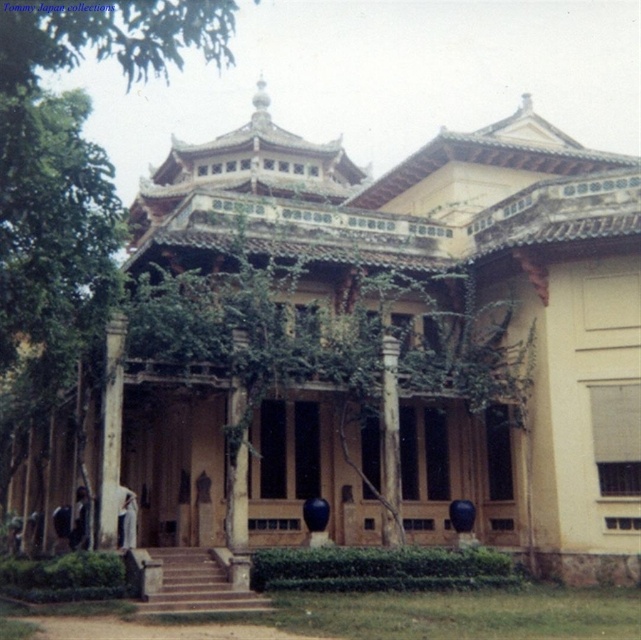
You are standing at the entrance of the traditional building and notice a green leafy tree at lower left and a smooth stone column at center. Which object is closer to you?

The green leafy tree at lower left is closer to you because it is in front of the smooth stone column at center.

You are standing in front of the traditional building and notice a green leafy tree and a smooth stone column. Which object is closer to you, the green leafy tree at lower left or the smooth stone column at center?

The green leafy tree at lower left is closer to you because it is positioned over the smooth stone column at center, indicating it is in front of it.